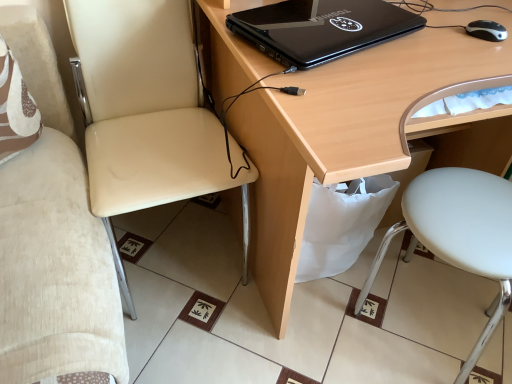
Find the location of `blank space situated above white matte stool at lower right, which is the 2th chair from left to right (from a real-world perspective)`. blank space situated above white matte stool at lower right, which is the 2th chair from left to right (from a real-world perspective) is located at coordinates (468, 211).